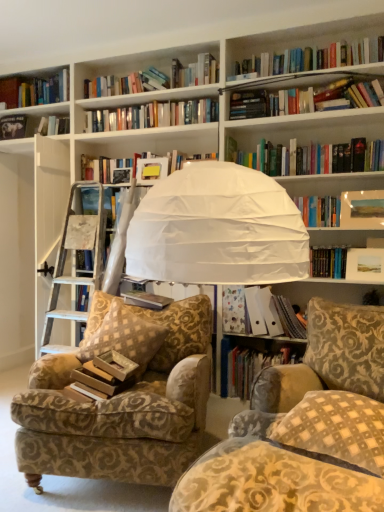
Question: Is matte paper folder at center right, the 3th book viewed from the top, at the right side of gold-patterned fabric pillow at center-left, which ranks as the 1th pillow in left-to-right order?

Choices:
 (A) no
 (B) yes

Answer: (B)

Question: Is matte paper folder at center right, the 4th book in the left-to-right sequence, shorter than gold-patterned fabric pillow at center-left, the 2th pillow from the right?

Choices:
 (A) no
 (B) yes

Answer: (B)

Question: Is matte paper folder at center right, marked as the first book in a right-to-left arrangement, positioned with its back to gold-patterned fabric pillow at center-left, the 1th pillow positioned from the back?

Choices:
 (A) no
 (B) yes

Answer: (A)

Question: Is the position of matte paper folder at center right, marked as the first book in a right-to-left arrangement, more distant than that of gold-patterned fabric pillow at center-left, the 2th pillow from the right?

Choices:
 (A) yes
 (B) no

Answer: (A)

Question: Does matte paper folder at center right, the 4th book in the left-to-right sequence, have a greater width compared to gold-patterned fabric pillow at center-left, which ranks as the 1th pillow in left-to-right order?

Choices:
 (A) no
 (B) yes

Answer: (A)

Question: In terms of height, does hardcover book at lower center, which is the third book in left-to-right order, look taller or shorter compared to patterned fabric armchair at left?

Choices:
 (A) tall
 (B) short

Answer: (B)

Question: Looking at their shapes, would you say hardcover book at lower center, which is the first book from bottom to top, is wider or thinner than patterned fabric armchair at left?

Choices:
 (A) thin
 (B) wide

Answer: (A)

Question: From the image's perspective, is hardcover book at lower center, arranged as the 2th book when viewed from the right, above or below patterned fabric armchair at left?

Choices:
 (A) above
 (B) below

Answer: (B)

Question: Considering the positions of point (228, 373) and point (127, 324), is point (228, 373) closer or farther from the camera than point (127, 324)?

Choices:
 (A) closer
 (B) farther

Answer: (B)

Question: From a real-world perspective, is patterned fabric armchair at left positioned above or below hardcover book at lower center, arranged as the 2th book when viewed from the right?

Choices:
 (A) below
 (B) above

Answer: (B)

Question: Is patterned fabric armchair at left bigger or smaller than hardcover book at lower center, which is the first book from bottom to top?

Choices:
 (A) big
 (B) small

Answer: (A)

Question: Is patterned fabric armchair at left situated inside hardcover book at lower center, which is the third book in left-to-right order, or outside?

Choices:
 (A) outside
 (B) inside

Answer: (A)

Question: Based on their positions, is patterned fabric armchair at left located to the left or right of hardcover book at lower center, which is the first book from bottom to top?

Choices:
 (A) right
 (B) left

Answer: (B)

Question: Considering the positions of point 327,440 and point 244,358, is point 327,440 closer or farther from the camera than point 244,358?

Choices:
 (A) farther
 (B) closer

Answer: (B)

Question: Considering the positions of checkered fabric pillow at lower right, the second pillow from the left, and hardcover book at lower center, arranged as the 2th book when viewed from the right, in the image, is checkered fabric pillow at lower right, the second pillow from the left, wider or thinner than hardcover book at lower center, arranged as the 2th book when viewed from the right,?

Choices:
 (A) wide
 (B) thin

Answer: (A)